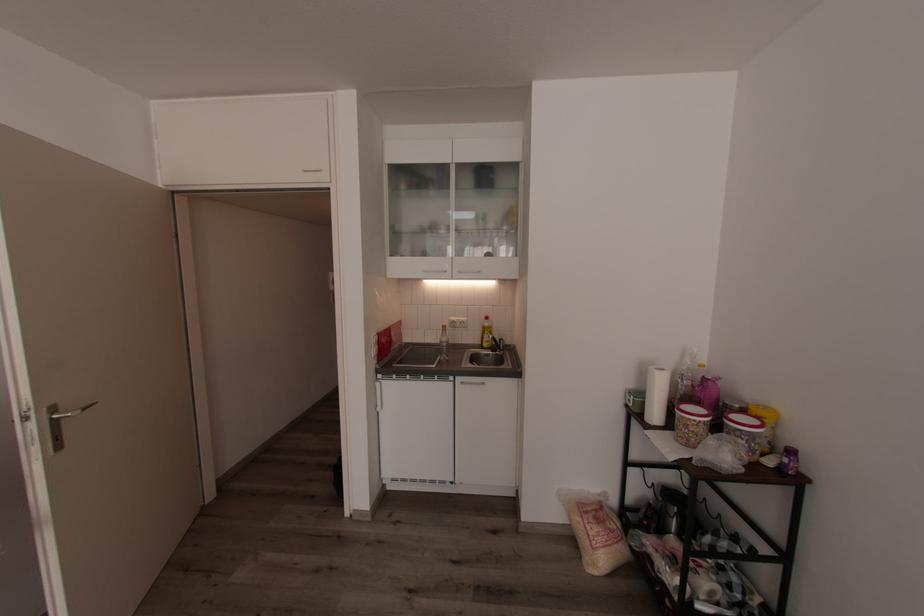
Which object does [766,422] point to?

This point indicates the yellow food container.